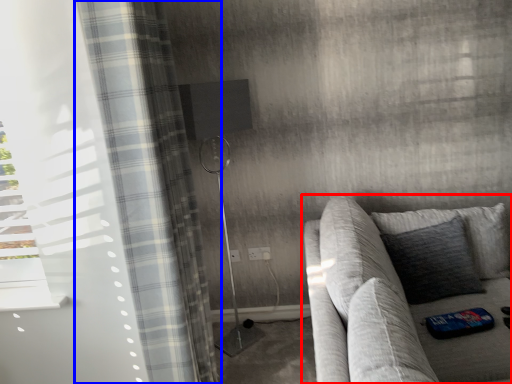
Question: Which object is further to the camera taking this photo, studio couch (highlighted by a red box) or curtain (highlighted by a blue box)?

Choices:
 (A) studio couch
 (B) curtain

Answer: (B)